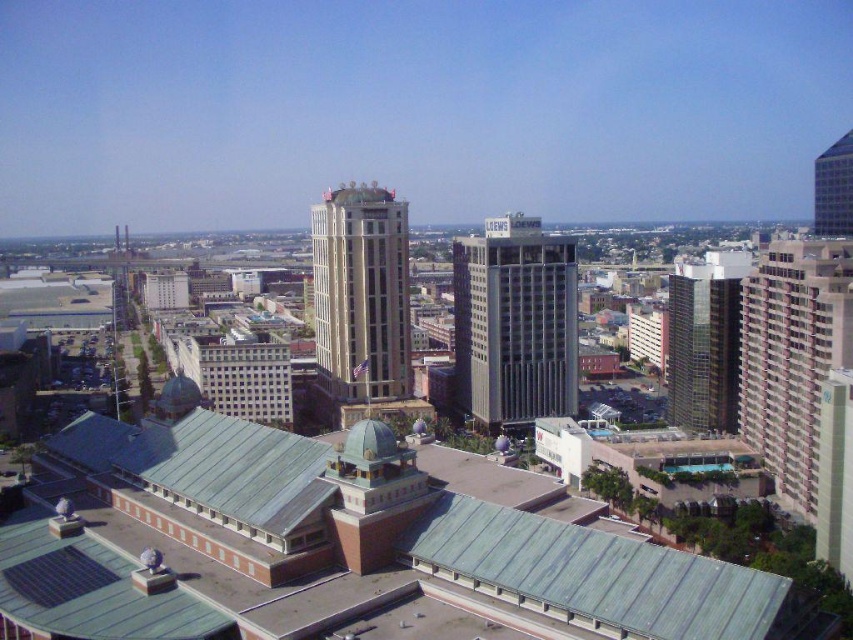
Question: Which point appears closest to the camera in this image?

Choices:
 (A) pyautogui.click(x=759, y=349)
 (B) pyautogui.click(x=489, y=269)

Answer: (A)

Question: Can you confirm if gray/concrete skyscraper at center is positioned below maroon brick building at right?

Choices:
 (A) no
 (B) yes

Answer: (A)

Question: Can you confirm if maroon brick building at right is smaller than glassy reflective skyscraper at upper right?

Choices:
 (A) no
 (B) yes

Answer: (B)

Question: From the image, what is the correct spatial relationship of green glass building at center-right in relation to glassy reflective skyscraper at upper right?

Choices:
 (A) below
 (B) above

Answer: (A)

Question: Which point is farther from the camera taking this photo?

Choices:
 (A) (393, 397)
 (B) (796, 435)
 (C) (668, 349)

Answer: (C)

Question: Which point is closer to the camera taking this photo?

Choices:
 (A) (717, 422)
 (B) (840, 144)

Answer: (A)